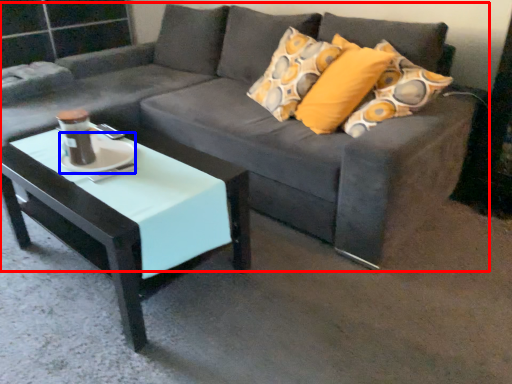
Question: Which object appears farthest to the camera in this image, studio couch (highlighted by a red box) or saucer (highlighted by a blue box)?

Choices:
 (A) studio couch
 (B) saucer

Answer: (B)